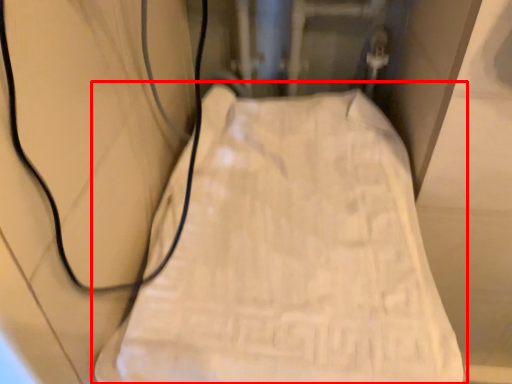
Question: From the image's perspective, where is furniture (annotated by the red box) located relative to wire?

Choices:
 (A) above
 (B) below

Answer: (B)